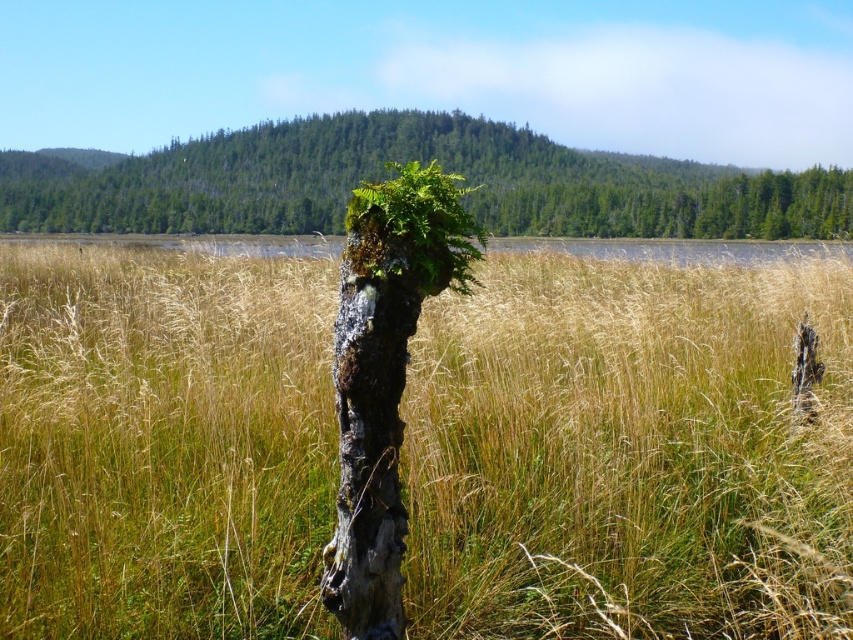
Does green mossy stump at center appear on the right side of green mossy fern at center?

In fact, green mossy stump at center is to the left of green mossy fern at center.

Can you confirm if green mossy stump at center is smaller than green mossy fern at center?

Incorrect, green mossy stump at center is not smaller in size than green mossy fern at center.

The height and width of the screenshot is (640, 853). What are the coordinates of `green mossy stump at center` in the screenshot? It's located at (422, 163).

The image size is (853, 640). In order to click on green mossy stump at center in this screenshot , I will do `click(422, 163)`.

Who is more distant from viewer, (x=672, y=497) or (x=347, y=540)?

Positioned behind is point (x=672, y=497).

Does point (119, 509) come in front of point (340, 588)?

No, (119, 509) is further to viewer.

Is point (554, 337) farther from camera compared to point (370, 230)?

That is True.

Find the location of a particular element. The height and width of the screenshot is (640, 853). brown grassy at center is located at coordinates (628, 452).

Between point (482, 170) and point (350, 570), which one is positioned in front?

Positioned in front is point (350, 570).

Does green mossy stump at center have a lesser width compared to grayish-brown bark tree trunk at center?

No.

Locate an element on the screen. green mossy stump at center is located at coordinates (422, 163).